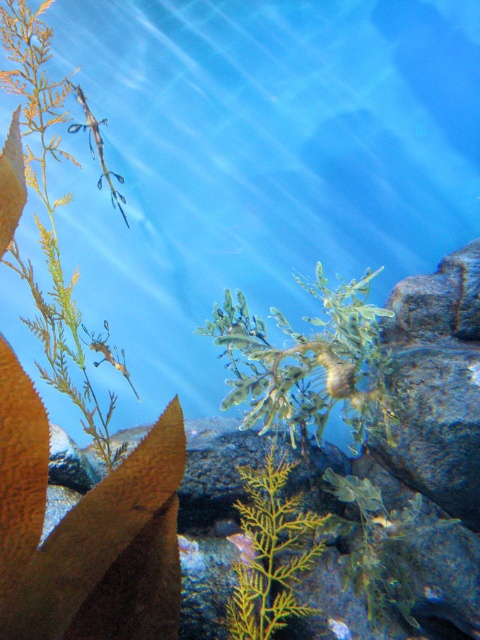
Question: Which object is closer to the camera taking this photo?

Choices:
 (A) green leafy plant at center
 (B) translucent glass seahorse at upper left
 (C) yellow-green leafy plant at center

Answer: (C)

Question: Which object is the closest to the green leafy plant at center?

Choices:
 (A) translucent glass seahorse at upper left
 (B) yellow-green leafy plant at center

Answer: (B)

Question: Does green leafy plant at center lie behind yellow-green leafy plant at center?

Choices:
 (A) no
 (B) yes

Answer: (B)

Question: Does yellow-green leafy plant at center appear under translucent glass seahorse at upper left?

Choices:
 (A) no
 (B) yes

Answer: (B)

Question: Does yellow-green leafy plant at center appear over translucent glass seahorse at upper left?

Choices:
 (A) yes
 (B) no

Answer: (B)

Question: Among these points, which one is farthest from the camera?

Choices:
 (A) (261, 614)
 (B) (355, 304)

Answer: (B)